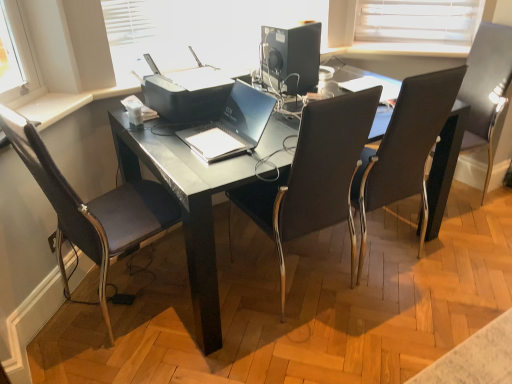
Identify the location of blank space to the left of black leather chair at center, arranged as the 2th chair when viewed from the left. Image resolution: width=512 pixels, height=384 pixels. (219, 289).